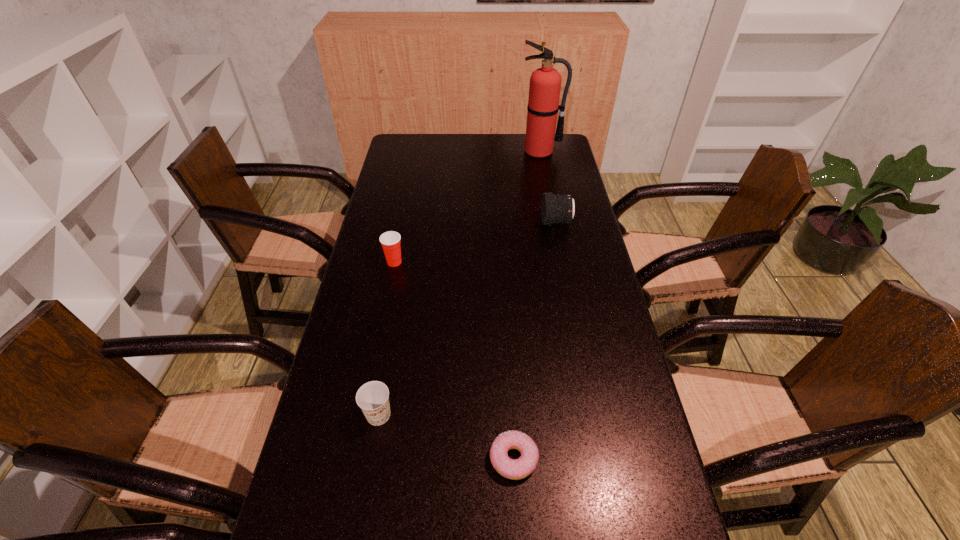
You are a GUI agent. You are given a task and a screenshot of the screen. Output one action in this format:
    pyautogui.click(x=<x>, y=<y>)
    Task: Click on the free spot located 0.050m at the front element of the fourth nearest object
    The image size is (960, 540).
    Given the screenshot: What is the action you would take?
    pyautogui.click(x=527, y=222)

Identify the location of free space located 0.070m at the front element of the fourth nearest object. (521, 222).

Image resolution: width=960 pixels, height=540 pixels. I want to click on vacant space located on the front of the third nearest object, so click(377, 346).

The image size is (960, 540). What are the coordinates of `free space located on the back of the shorter Dixie cup` in the screenshot? It's located at click(400, 292).

The width and height of the screenshot is (960, 540). I want to click on vacant space located on the right of the shortest object, so click(x=594, y=458).

Where is `object at the far edge`? The height and width of the screenshot is (540, 960). object at the far edge is located at coordinates (545, 83).

Locate an element on the screen. This screenshot has width=960, height=540. fire extinguisher that is at the right edge is located at coordinates (545, 83).

At what (x,y) coordinates should I click in order to perform the action: click on telephoto lens present at the right edge. Please return your answer as a coordinate pair (x, y). Image resolution: width=960 pixels, height=540 pixels. Looking at the image, I should click on (557, 208).

Locate an element on the screen. The height and width of the screenshot is (540, 960). object that is at the far right corner is located at coordinates (545, 83).

At what (x,y) coordinates should I click in order to perform the action: click on free location at the far edge of the desktop. Please return your answer as a coordinate pair (x, y). The image size is (960, 540). Looking at the image, I should click on (485, 141).